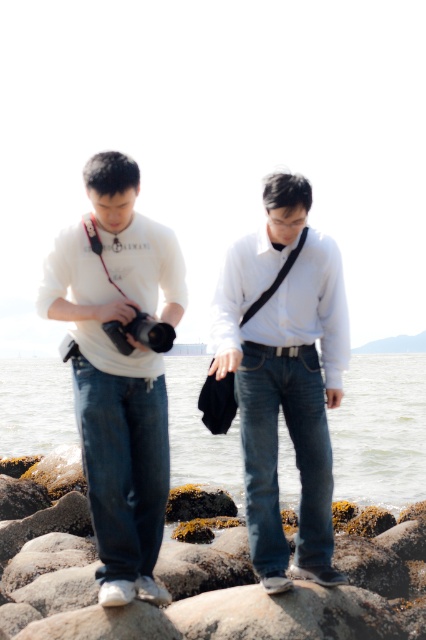
Does clear water at lower center appear on the left side of matte black camera at left?

In fact, clear water at lower center is to the right of matte black camera at left.

Is point (336, 417) positioned after point (158, 330)?

Yes, it is behind point (158, 330).

Image resolution: width=426 pixels, height=640 pixels. I want to click on clear water at lower center, so click(x=380, y=432).

Is white matte shirt at left further to camera compared to clear water at lower center?

No.

Who is lower down, white matte shirt at left or clear water at lower center?

clear water at lower center

Is point (85, 362) less distant than point (400, 374)?

Yes, point (85, 362) is closer to viewer.

At what (x,y) coordinates should I click in order to perform the action: click on white matte shirt at left. Please return your answer as a coordinate pair (x, y). The image size is (426, 640). Looking at the image, I should click on (118, 369).

Is point (115, 192) farther from camera compared to point (339, 397)?

No.

Is point (81, 269) positioned before point (317, 476)?

Yes, point (81, 269) is closer to viewer.

Locate an element on the screen. This screenshot has height=640, width=426. white matte shirt at left is located at coordinates (118, 369).